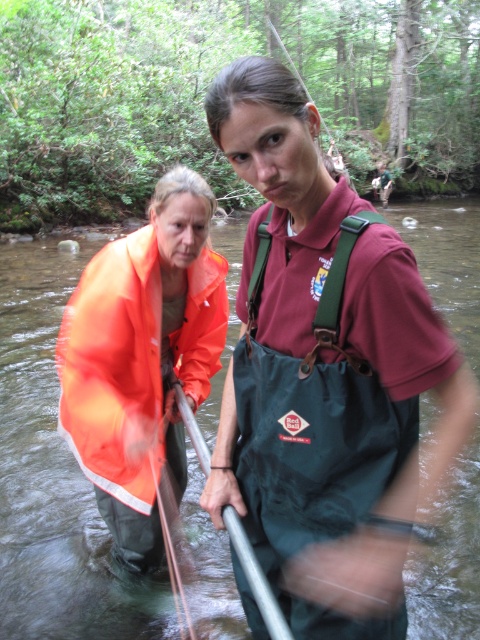
Based on the photo, can you confirm if orange waterproof jacket at center is shorter than silver metallic paddle at center?

No, orange waterproof jacket at center is not shorter than silver metallic paddle at center.

Who is lower down, orange waterproof jacket at center or silver metallic paddle at center?

silver metallic paddle at center is lower down.

Where is `orange waterproof jacket at center`? This screenshot has width=480, height=640. orange waterproof jacket at center is located at coordinates [x=142, y=356].

Between clear water at center and orange waterproof jacket at center, which one is positioned lower?

orange waterproof jacket at center

Can you confirm if clear water at center is taller than orange waterproof jacket at center?

Yes, clear water at center is taller than orange waterproof jacket at center.

Does point (39, 380) come closer to viewer compared to point (108, 445)?

No, (39, 380) is behind (108, 445).

Identify the location of clear water at center. (54, 474).

Which is more to the left, clear water at center or silver metallic paddle at center?

Positioned to the left is silver metallic paddle at center.

Who is lower down, clear water at center or silver metallic paddle at center?

silver metallic paddle at center is below.

Find the location of a particular element. The width and height of the screenshot is (480, 640). clear water at center is located at coordinates (54, 474).